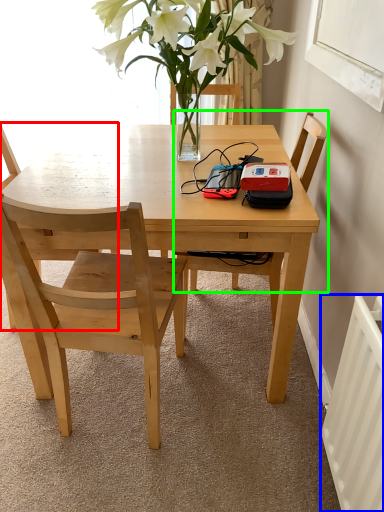
Question: Based on their relative distances, which object is nearer to chair (highlighted by a red box)? Choose from radiator (highlighted by a blue box) and chair (highlighted by a green box).

Choices:
 (A) radiator
 (B) chair

Answer: (B)